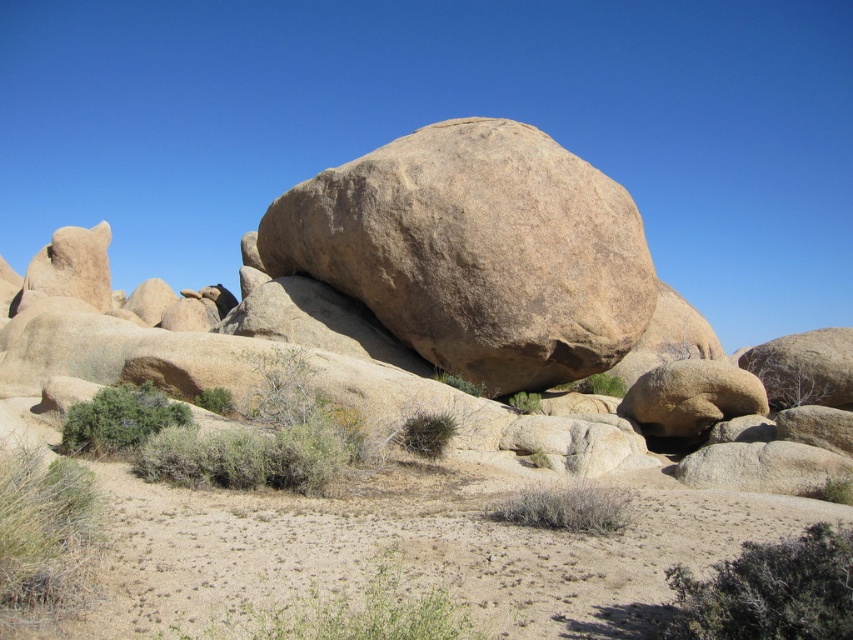
Which is above, smooth beige rock at center or brown rough boulder at center?

Positioned higher is brown rough boulder at center.

Does smooth beige rock at center have a greater height compared to brown rough boulder at center?

Correct, smooth beige rock at center is much taller as brown rough boulder at center.

Identify the location of smooth beige rock at center. The width and height of the screenshot is (853, 640). (426, 305).